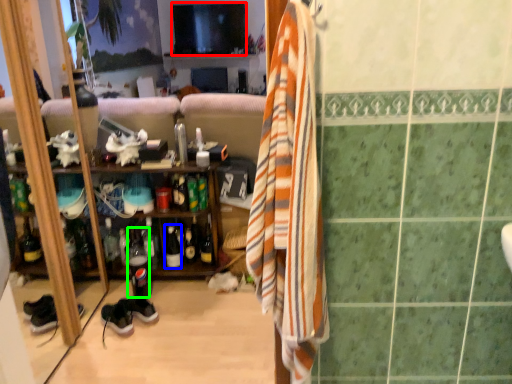
Question: Estimate the real-world distances between objects in this image. Which object is farther from television (highlighted by a red box), bottle (highlighted by a blue box) or bottle (highlighted by a green box)?

Choices:
 (A) bottle
 (B) bottle

Answer: (A)